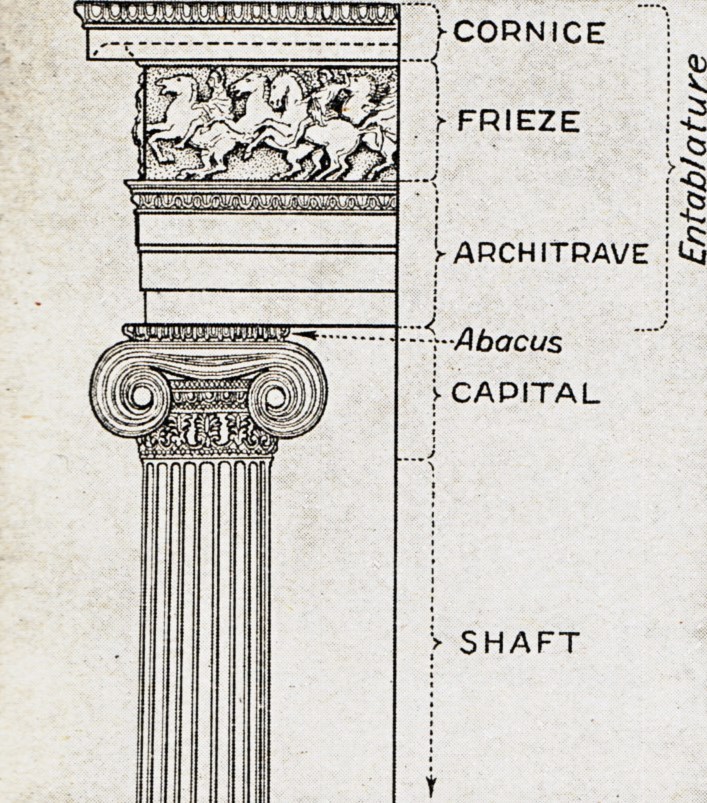
The image size is (707, 803). I want to click on cornice, so click(532, 34), click(365, 26).